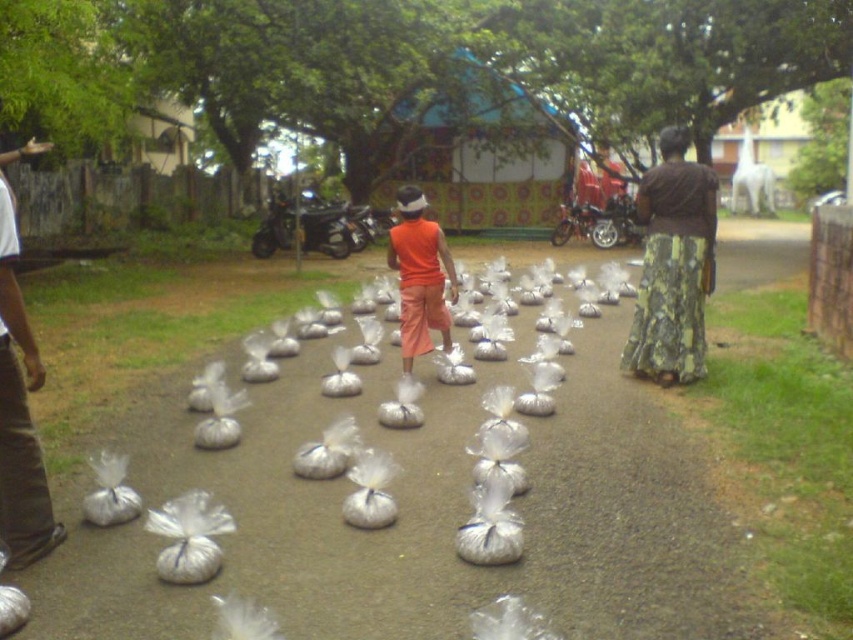
You are a delivery person who needs to place a package that is 1.5 meters long between the transparent plastic bags at center and the orange cotton shorts at center. Can the package fit in the space between them?

The transparent plastic bags at center and the orange cotton shorts at center are 1.55 meters apart. Since the package is 1.5 meters long, it can fit in the space between them as the distance is slightly longer than the package.

You are a photographer trying to capture a photo of the green floral skirt at right and the orange cotton shorts at center. If you want to ensure both are fully visible in the frame without cropping, which object should you adjust your camera angle to focus on first?

The green floral skirt at right might be wider than orange cotton shorts at center, so you should focus on the green floral skirt at right first to ensure it fits in the frame.

You are a delivery person who needs to place a new batch of rice bags at the same location as the existing transparent plastic bags at center. According to the image, where exactly should you position the new bags?

You should position the new bags at the 2D coordinates point [416,515], which is the same location as the transparent plastic bags at center.